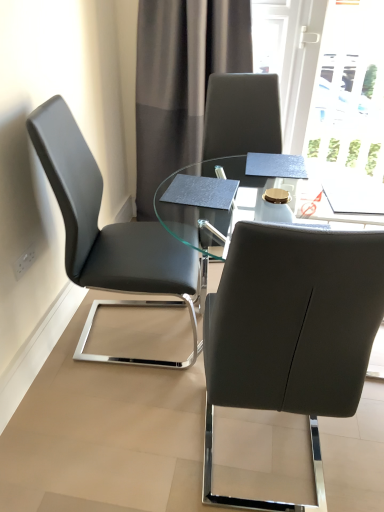
Question: From the image's perspective, does matte black chair at center, the second chair when ordered from left to right, appear lower than transparent glass table at center?

Choices:
 (A) no
 (B) yes

Answer: (B)

Question: Would you consider matte black chair at center, the second chair when ordered from left to right, to be distant from transparent glass table at center?

Choices:
 (A) no
 (B) yes

Answer: (A)

Question: Is matte black chair at center, the first chair when ordered from right to left, outside of transparent glass table at center?

Choices:
 (A) yes
 (B) no

Answer: (B)

Question: Are matte black chair at center, the second chair when ordered from left to right, and transparent glass table at center beside each other?

Choices:
 (A) no
 (B) yes

Answer: (A)

Question: Considering the relative sizes of matte black chair at center, the second chair when ordered from left to right, and transparent glass table at center in the image provided, is matte black chair at center, the second chair when ordered from left to right, smaller than transparent glass table at center?

Choices:
 (A) no
 (B) yes

Answer: (B)

Question: Based on their sizes in the image, would you say transparent glass table at center is bigger or smaller than matte black chair at center, the first chair when ordered from right to left?

Choices:
 (A) big
 (B) small

Answer: (A)

Question: From a real-world perspective, is transparent glass table at center above or below matte black chair at center, the first chair when ordered from right to left?

Choices:
 (A) above
 (B) below

Answer: (B)

Question: Considering the positions of point (238, 180) and point (226, 332), is point (238, 180) closer or farther from the camera than point (226, 332)?

Choices:
 (A) farther
 (B) closer

Answer: (A)

Question: In terms of width, does transparent glass table at center look wider or thinner when compared to matte black chair at center, the second chair when ordered from left to right?

Choices:
 (A) thin
 (B) wide

Answer: (B)

Question: In terms of width, does gray fabric curtain at upper center look wider or thinner when compared to transparent glass table at center?

Choices:
 (A) thin
 (B) wide

Answer: (A)

Question: Is gray fabric curtain at upper center inside or outside of transparent glass table at center?

Choices:
 (A) inside
 (B) outside

Answer: (B)

Question: Considering the positions of gray fabric curtain at upper center and transparent glass table at center in the image, is gray fabric curtain at upper center bigger or smaller than transparent glass table at center?

Choices:
 (A) big
 (B) small

Answer: (B)

Question: Visually, is gray fabric curtain at upper center positioned to the left or to the right of transparent glass table at center?

Choices:
 (A) left
 (B) right

Answer: (A)

Question: Is transparent glass table at center bigger or smaller than gray fabric curtain at upper center?

Choices:
 (A) small
 (B) big

Answer: (B)

Question: Do you think transparent glass table at center is within gray fabric curtain at upper center, or outside of it?

Choices:
 (A) outside
 (B) inside

Answer: (A)